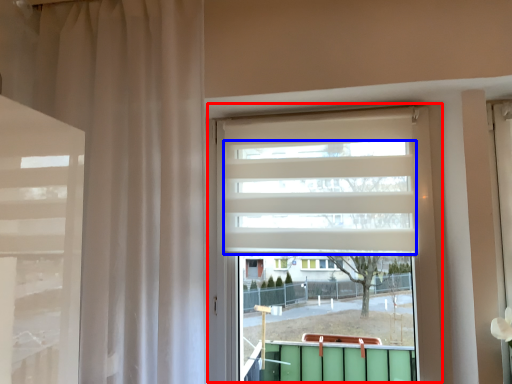
Question: Which point is further to the camera, window (highlighted by a red box) or blind (highlighted by a blue box)?

Choices:
 (A) window
 (B) blind

Answer: (B)